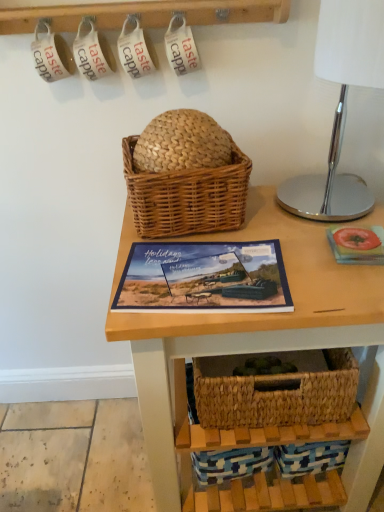
Identify the location of vacant point above matte blue book at center (from a real-world perspective). (203, 270).